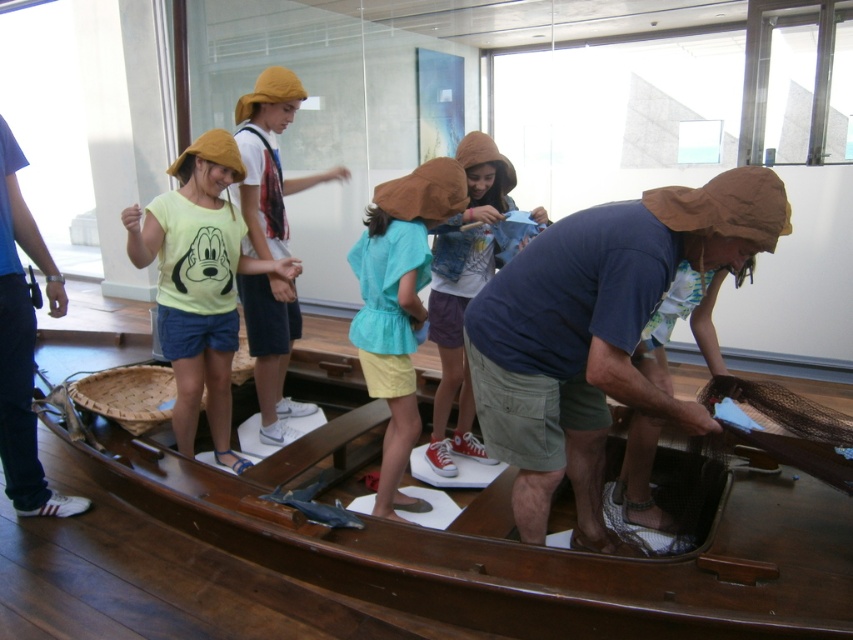
You are a participant in the activity and need to determine if the brown fabric hat at center can be placed on top of the yellow matte shirt at upper left without falling over. Based on their sizes, can this be done?

The brown fabric hat at center might be wider than yellow matte shirt at upper left, so it may not fit stably on top of it and could potentially fall over.

You are an event organizer planning to move the wooden boat at center and the yellow matte shirt at upper left to a new location. The doorway you need to pass through is 1 meter wide. Based on their sizes, can both items fit through the doorway side by side?

The wooden boat at center is wider than the yellow matte shirt at upper left. Since the doorway is 1 meter wide, we need to know the exact widths of both items to determine if they can fit side by side. However, the provided information only states that the wooden boat is larger in width than the shirt, but without specific measurements, we cannot confirm if their combined width exceeds 1 meter.